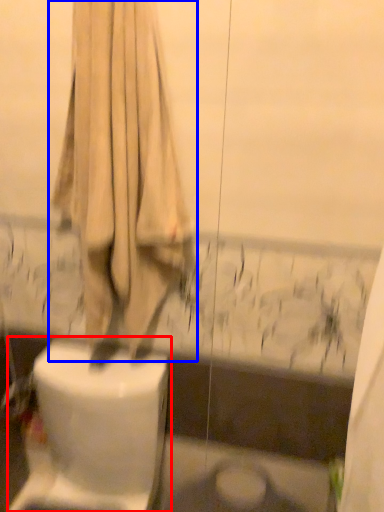
Question: Among these objects, which one is nearest to the camera, toilet (highlighted by a red box) or curtain (highlighted by a blue box)?

Choices:
 (A) toilet
 (B) curtain

Answer: (B)